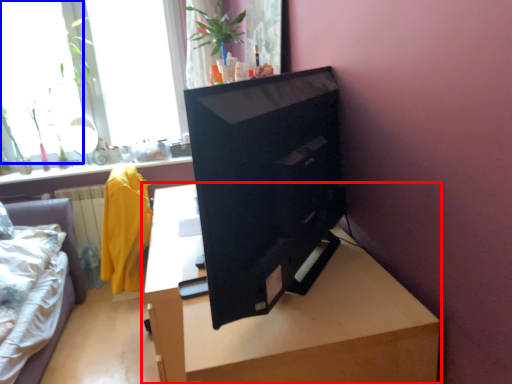
Question: Which object is closer to the camera taking this photo, table (highlighted by a red box) or window (highlighted by a blue box)?

Choices:
 (A) table
 (B) window

Answer: (A)